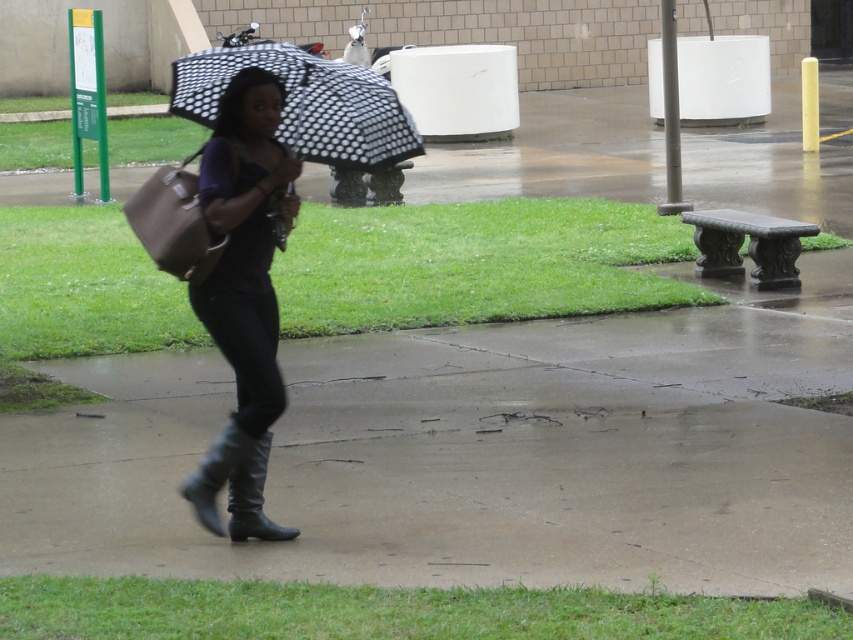
Question: Is smooth concrete pavement at center smaller than leather high-heeled boot at center?

Choices:
 (A) yes
 (B) no

Answer: (A)

Question: Does polka dot fabric umbrella at center have a larger size compared to black leather boot at lower center?

Choices:
 (A) yes
 (B) no

Answer: (B)

Question: Which point appears closest to the camera in this image?

Choices:
 (A) (271, 90)
 (B) (345, 529)
 (C) (258, 438)
 (D) (292, 140)

Answer: (A)

Question: Which point is closer to the camera taking this photo?

Choices:
 (A) (370, 118)
 (B) (253, 509)
 (C) (192, 484)

Answer: (C)

Question: Is smooth concrete pavement at center to the right of black leather boot at lower center from the viewer's perspective?

Choices:
 (A) no
 (B) yes

Answer: (B)

Question: Which object is closer to the camera taking this photo?

Choices:
 (A) smooth concrete pavement at center
 (B) matte black boots at center
 (C) black leather boot at lower center
 (D) leather high-heeled boot at center

Answer: (B)